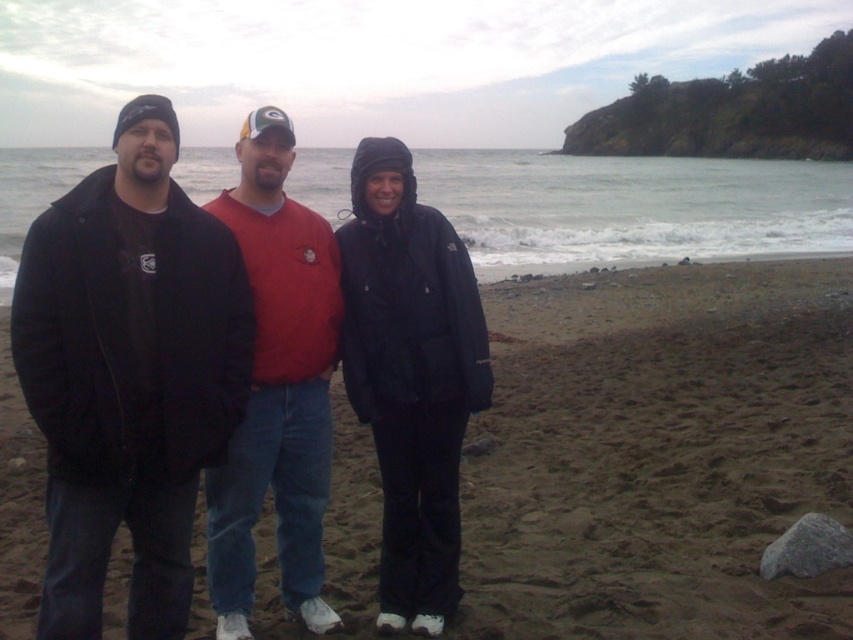
You are standing on the beach and see the matte black jacket at center and the matte red sweater at center. Which one is positioned to the right side?

The matte black jacket at center is positioned to the right of the matte red sweater at center.

Consider the image. You are standing on the brown sandy beach at center and want to move to the matte black jacket at left. Which direction should you walk?

You should walk to the left because the brown sandy beach at center is to the right of the matte black jacket at left, meaning the jacket is positioned to your left relative to your current position on the beach.

You are a photographer standing on the beach and want to take a group photo of the matte black jacket at left and the matte black jacket at center. If your camera has a maximum focus range of 5 feet, will you be able to capture both subjects clearly in the same shot?

The matte black jacket at left is 5.41 feet from the matte black jacket at center. Since the distance between them exceeds the camera maximum focus range of 5 feet, the camera cannot focus on both subjects simultaneously. You might need to adjust their positions or use a different camera setting.